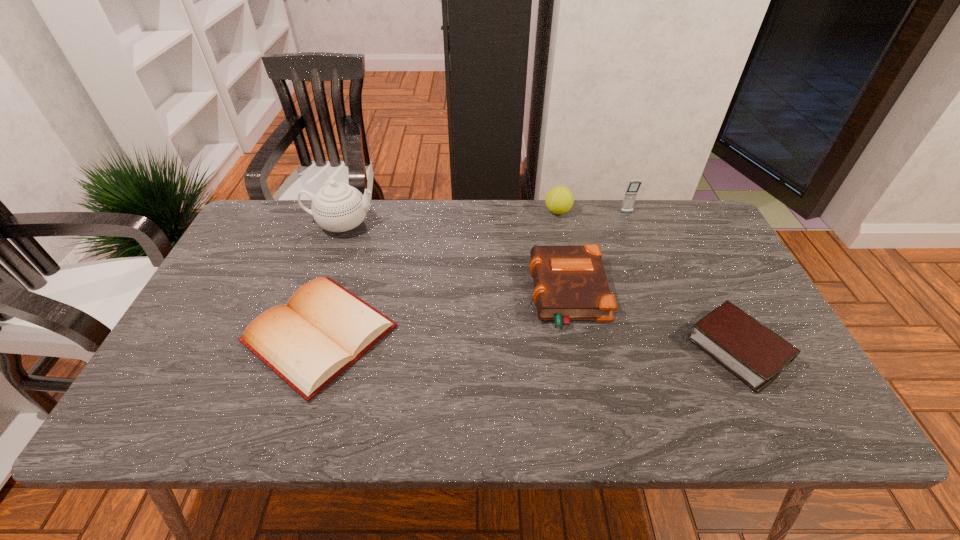
Where is `chinaware`? chinaware is located at coordinates (338, 207).

You are a GUI agent. You are given a task and a screenshot of the screen. Output one action in this format:
    pyautogui.click(x=<x>, y=<y>)
    Task: Click on the fifth shortest object
    
    Given the screenshot: What is the action you would take?
    pyautogui.click(x=629, y=199)

This screenshot has width=960, height=540. I want to click on cellular telephone, so click(x=629, y=199).

Find the location of a particular element. The width and height of the screenshot is (960, 540). the fourth shortest object is located at coordinates (559, 199).

Where is `the second Bible from right to left`? Image resolution: width=960 pixels, height=540 pixels. the second Bible from right to left is located at coordinates (570, 283).

At what (x,y) coordinates should I click in order to perform the action: click on the tallest Bible. Please return your answer as a coordinate pair (x, y). Image resolution: width=960 pixels, height=540 pixels. Looking at the image, I should click on (570, 283).

I want to click on the rightmost Bible, so click(748, 349).

The height and width of the screenshot is (540, 960). Identify the location of the rightmost object. (748, 349).

The width and height of the screenshot is (960, 540). In order to click on the shortest object in this screenshot , I will do `click(324, 328)`.

You are a GUI agent. You are given a task and a screenshot of the screen. Output one action in this format:
    pyautogui.click(x=<x>, y=<y>)
    Task: Click on the leftmost Bible
    The width and height of the screenshot is (960, 540).
    Given the screenshot: What is the action you would take?
    pyautogui.click(x=324, y=328)